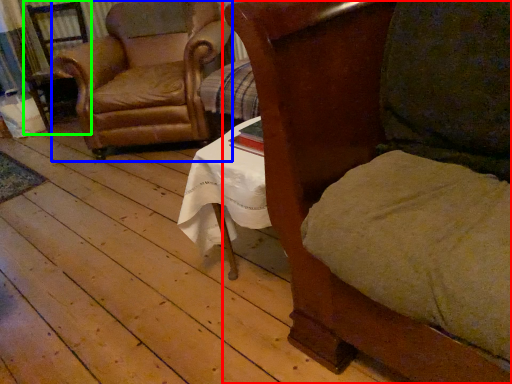
Question: Estimate the real-world distances between objects in this image. Which object is farther from chair (highlighted by a red box), chair (highlighted by a blue box) or armchair (highlighted by a green box)?

Choices:
 (A) chair
 (B) armchair

Answer: (B)